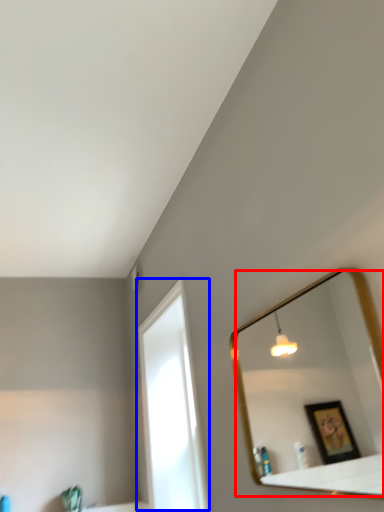
Question: Which object appears farthest to the camera in this image, mirror (highlighted by a red box) or window (highlighted by a blue box)?

Choices:
 (A) mirror
 (B) window

Answer: (B)